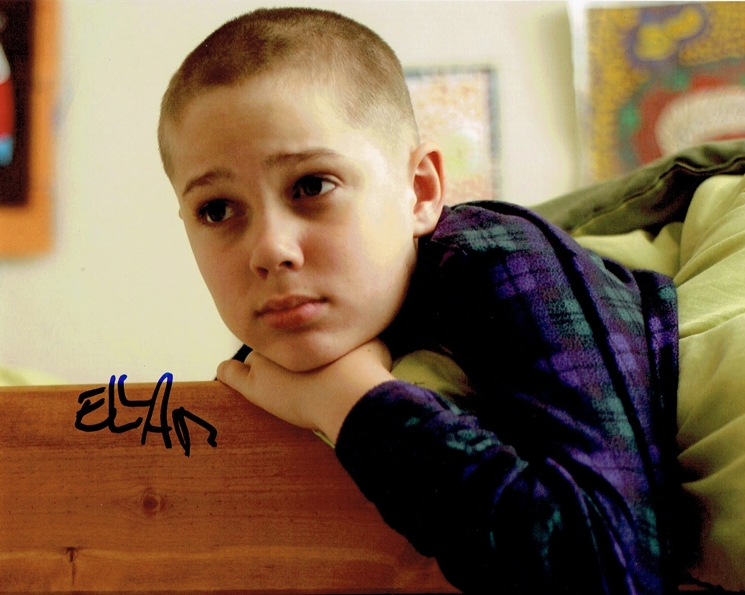
This screenshot has width=745, height=595. Find the location of `light green blanket`. light green blanket is located at coordinates (725, 283), (714, 350).